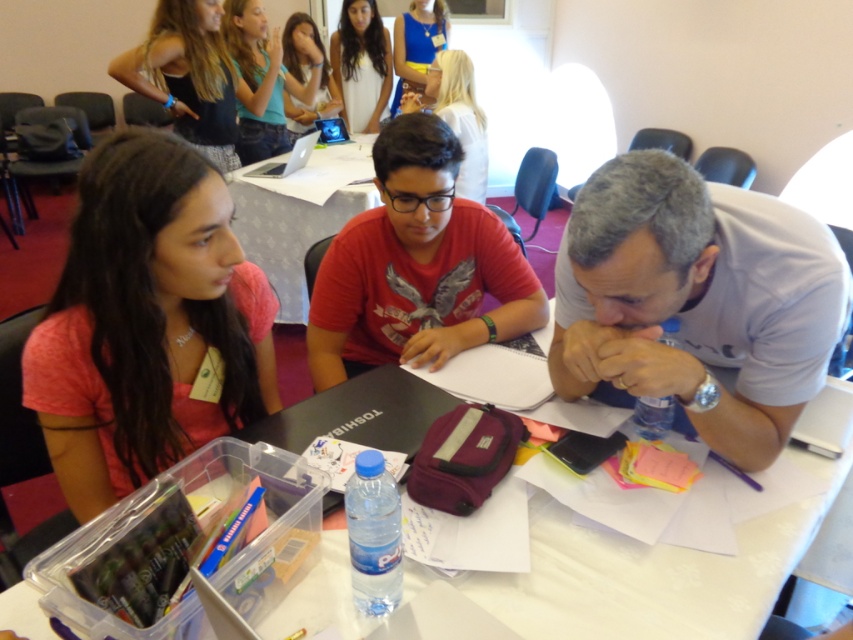
Can you confirm if red matte shirt at center is wider than black plastic table at center?

Incorrect, red matte shirt at center's width does not surpass black plastic table at center's.

Which is more to the left, red matte shirt at center or black plastic table at center?

Positioned to the left is black plastic table at center.

Image resolution: width=853 pixels, height=640 pixels. What do you see at coordinates (416, 266) in the screenshot? I see `red matte shirt at center` at bounding box center [416, 266].

Image resolution: width=853 pixels, height=640 pixels. Find the location of `red matte shirt at center`. red matte shirt at center is located at coordinates (416, 266).

This screenshot has width=853, height=640. Find the location of `white matte shirt at center`. white matte shirt at center is located at coordinates click(x=695, y=300).

Between white matte shirt at center and black plastic table at center, which one appears on the right side from the viewer's perspective?

white matte shirt at center

Where is `white matte shirt at center`? Image resolution: width=853 pixels, height=640 pixels. white matte shirt at center is located at coordinates (695, 300).

Does pink matte shirt at left have a greater width compared to clear plastic container at lower left?

No, pink matte shirt at left is not wider than clear plastic container at lower left.

How far apart are pink matte shirt at left and clear plastic container at lower left?

A distance of 19.74 inches exists between pink matte shirt at left and clear plastic container at lower left.

Is point (99, 224) more distant than point (554, 529)?

No.

You are a GUI agent. You are given a task and a screenshot of the screen. Output one action in this format:
    pyautogui.click(x=<x>, y=<y>)
    Task: Click on the pink matte shirt at left
    Image resolution: width=853 pixels, height=640 pixels.
    Given the screenshot: What is the action you would take?
    pyautogui.click(x=146, y=323)